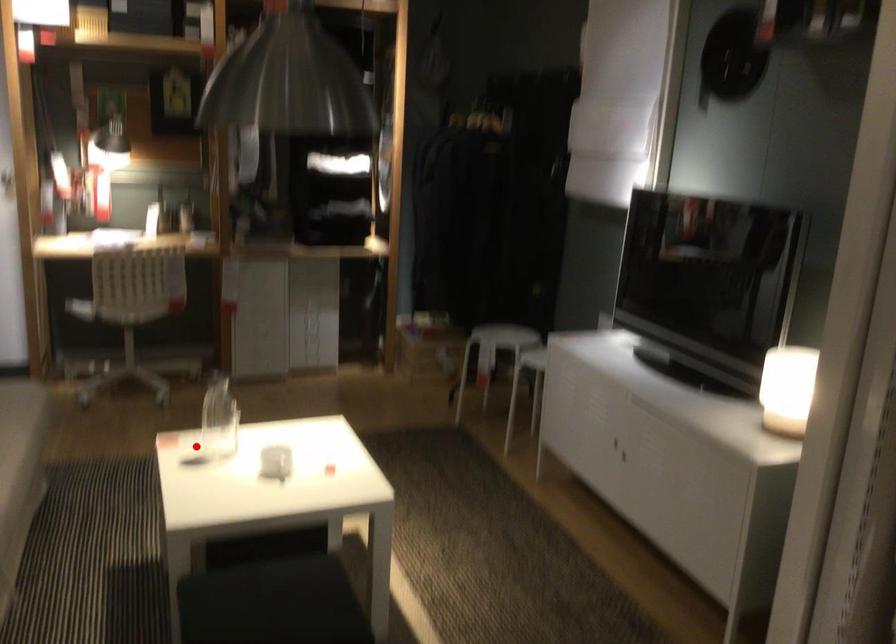
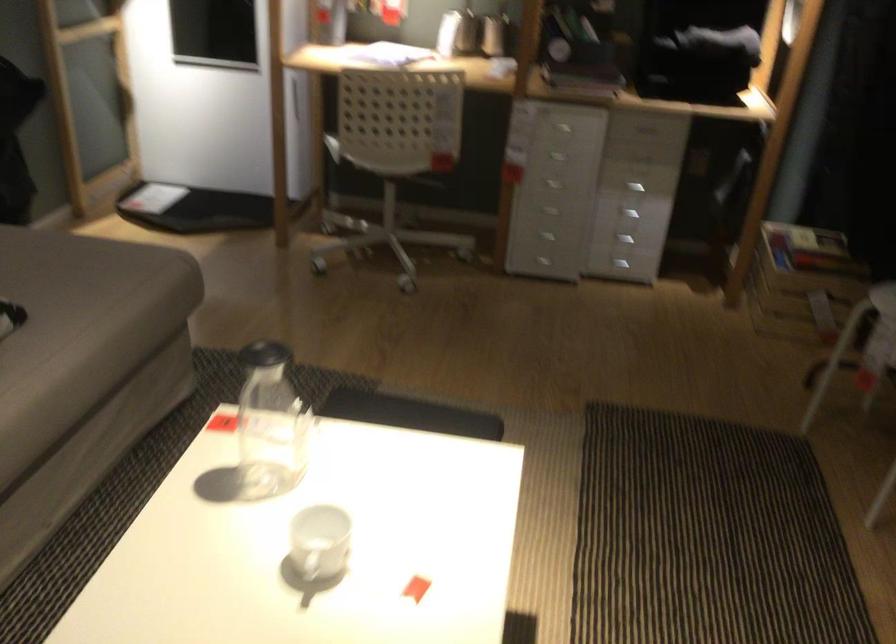
Where in the second image is the point corresponding to the highlighted location from the first image?

(270, 424)